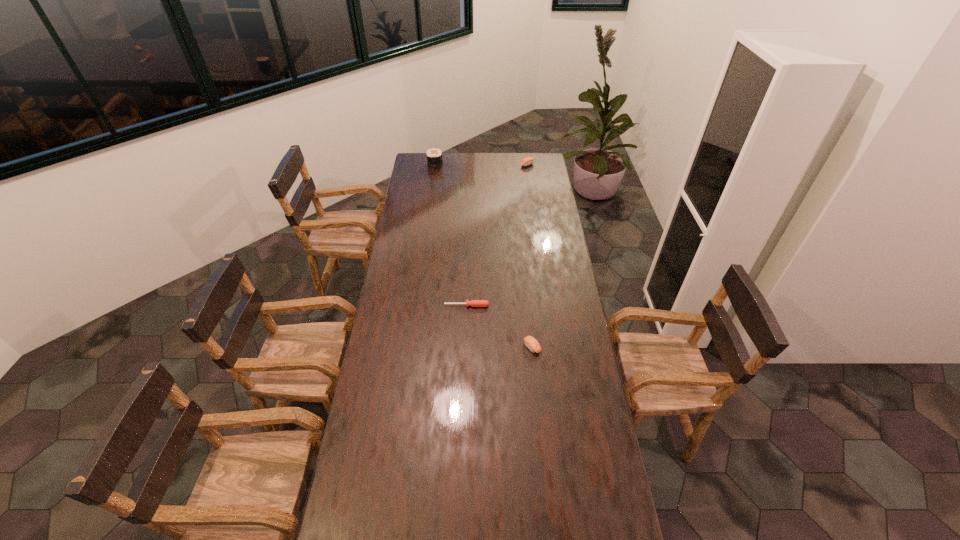
You are a GUI agent. You are given a task and a screenshot of the screen. Output one action in this format:
    pyautogui.click(x=<x>, y=<y>)
    Task: Click on the empty location between the leftmost object and the shortest object
    
    Given the screenshot: What is the action you would take?
    pyautogui.click(x=451, y=235)

This screenshot has width=960, height=540. Identify the location of object that is the closest one to the second nearest object. (531, 343).

Point out which object is positioned as the third nearest to the second sushi from right to left. Please provide its 2D coordinates. Your answer should be formatted as a tuple, i.e. [(x, y)], where the tuple contains the x and y coordinates of a point satisfying the conditions above.

[(434, 156)]

Locate an element on the screen. sushi identified as the closest to the rightmost object is located at coordinates (434, 156).

Image resolution: width=960 pixels, height=540 pixels. What are the coordinates of `sushi that stands as the second closest to the tallest object` in the screenshot? It's located at point(531,343).

At what (x,y) coordinates should I click in order to perform the action: click on vacant region that satisfies the following two spatial constraints: 1. on the back side of the shortest sushi; 2. on the left side of the second shortest sushi. Please return your answer as a coordinate pair (x, y). The image size is (960, 540). Looking at the image, I should click on (514, 165).

Locate an element on the screen. The width and height of the screenshot is (960, 540). free space in the image that satisfies the following two spatial constraints: 1. on the front side of the tallest object; 2. on the left side of the third farthest object is located at coordinates (416, 306).